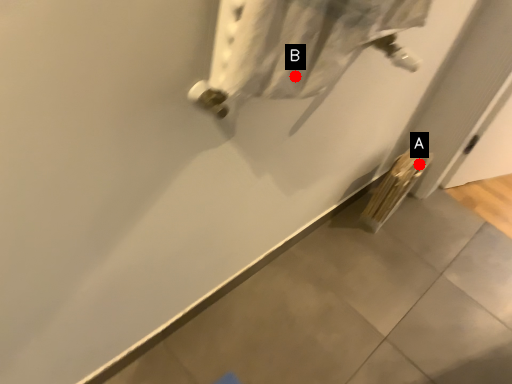
Question: Two points are circled on the image, labeled by A and B beside each circle. Which point is closer to the camera taking this photo?

Choices:
 (A) A is closer
 (B) B is closer

Answer: (B)